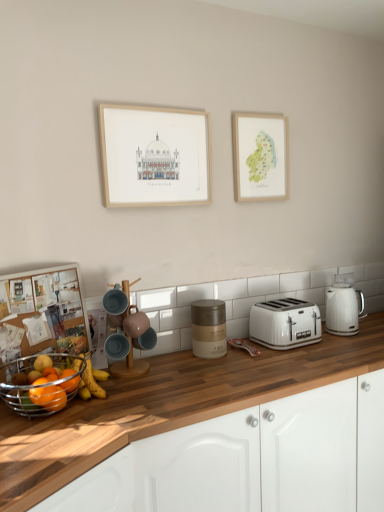
The width and height of the screenshot is (384, 512). Find the location of `free space in front of white plastic toaster at center`. free space in front of white plastic toaster at center is located at coordinates (300, 358).